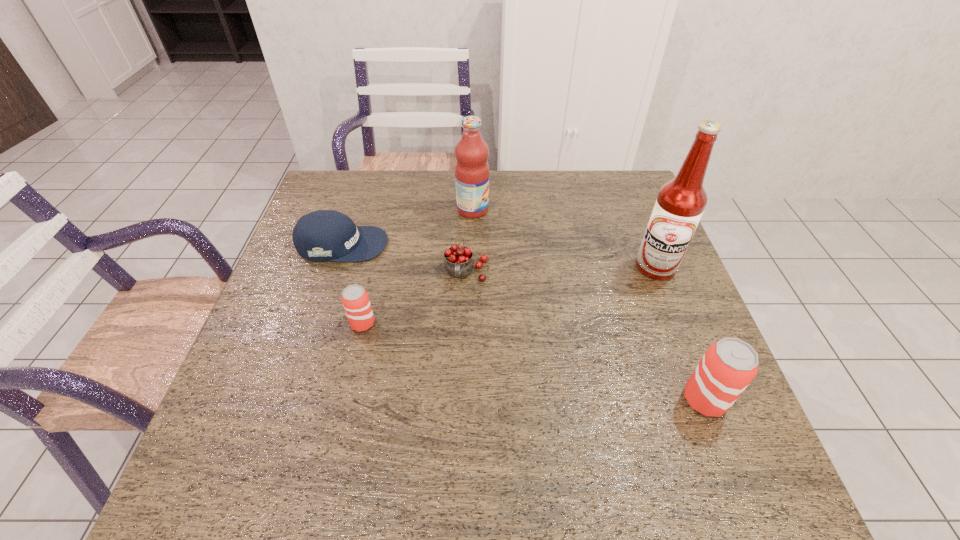
Find the location of `vacant space that satisfies the following two spatial constraints: 1. on the front-facing side of the baseball cap; 2. on the back side of the taller beer can`. vacant space that satisfies the following two spatial constraints: 1. on the front-facing side of the baseball cap; 2. on the back side of the taller beer can is located at coordinates (292, 400).

I want to click on blank area in the image that satisfies the following two spatial constraints: 1. on the front label of the farthest object; 2. on the front side of the shorter beer can, so click(x=470, y=323).

I want to click on free space that satisfies the following two spatial constraints: 1. on the front side of the nearest object; 2. on the left side of the farther beer can, so click(x=345, y=400).

Locate an element on the screen. This screenshot has height=540, width=960. vacant space that satisfies the following two spatial constraints: 1. on the front label of the fruit juice; 2. on the back side of the right beer can is located at coordinates click(x=469, y=400).

Find the location of a particular element. This screenshot has width=960, height=540. vacant area that satisfies the following two spatial constraints: 1. on the back side of the taller beer can; 2. on the front-facing side of the baseball cap is located at coordinates (644, 244).

Where is `vacant space that satisfies the following two spatial constraints: 1. on the back side of the right beer can; 2. on the front-facing side of the baseball cap`? vacant space that satisfies the following two spatial constraints: 1. on the back side of the right beer can; 2. on the front-facing side of the baseball cap is located at coordinates (644, 244).

What are the coordinates of `free space that satisfies the following two spatial constraints: 1. on the front label of the fourth shortest object; 2. on the left side of the fruit juice` in the screenshot? It's located at (469, 400).